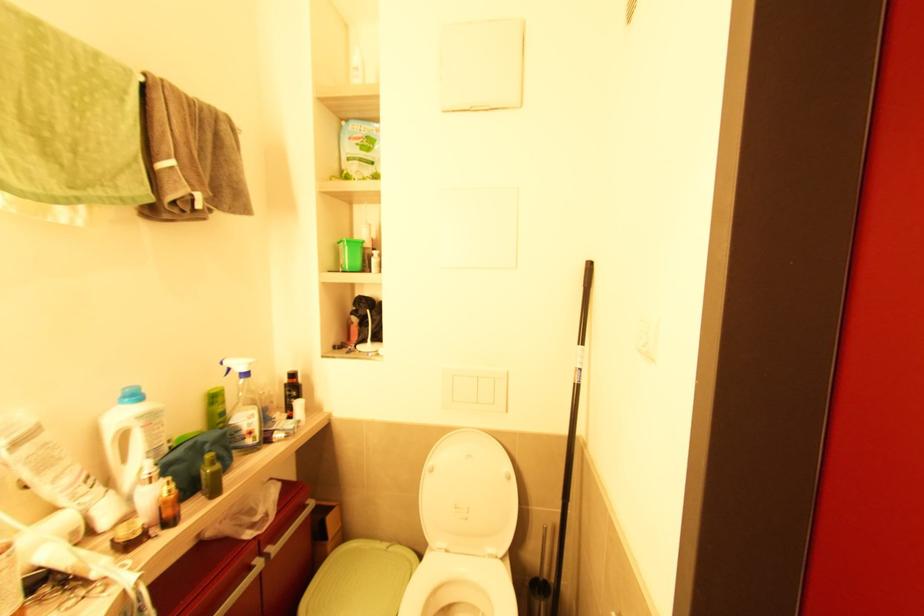
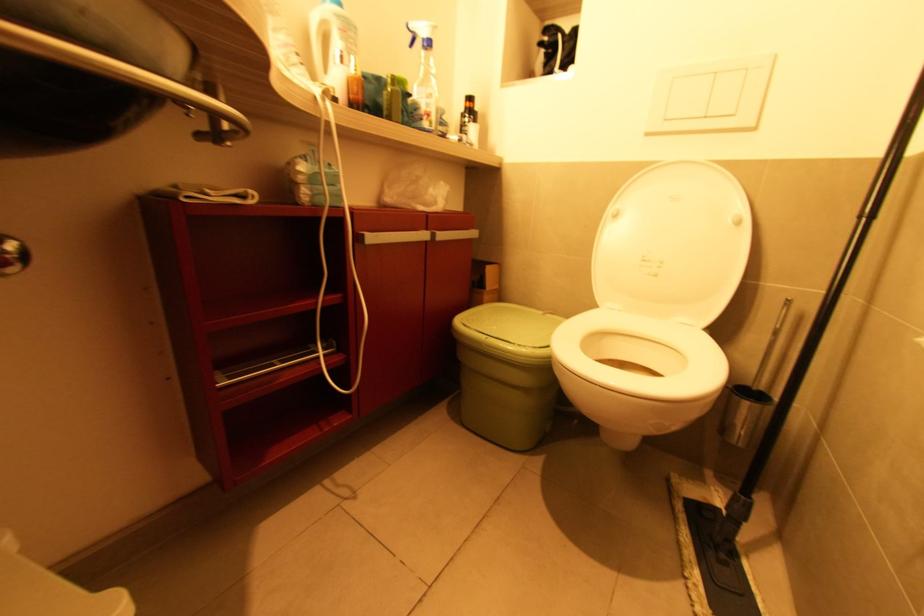
Which direction would the cameraman need to move to produce the second image?

The cameraman walked toward left, forward.